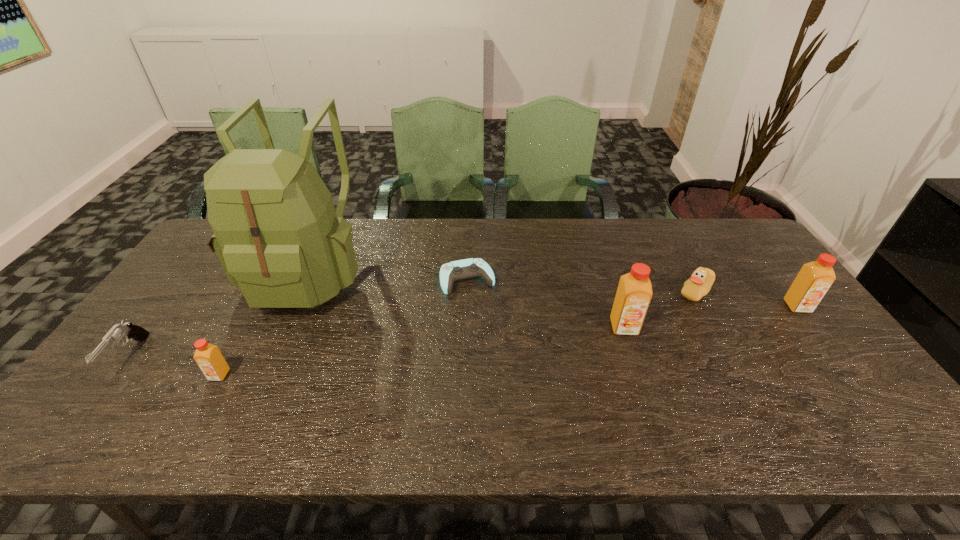
This screenshot has width=960, height=540. Identify the location of free spot between the fourth object from left to right and the duck. (582, 286).

At what (x,y) coordinates should I click in order to perform the action: click on free area in between the shortest orange juice and the fourth object from right to left. Please return your answer as a coordinate pair (x, y). Image resolution: width=960 pixels, height=540 pixels. Looking at the image, I should click on (344, 327).

Locate an element on the screen. The image size is (960, 540). free space between the second nearest orange juice and the tallest object is located at coordinates (467, 299).

At what (x,y) coordinates should I click in order to perform the action: click on free space between the second orange juice from left to right and the second shortest orange juice. Please return your answer as a coordinate pair (x, y). The height and width of the screenshot is (540, 960). Looking at the image, I should click on (710, 316).

Where is `unoccupied area between the leftmost object and the backpack`? The width and height of the screenshot is (960, 540). unoccupied area between the leftmost object and the backpack is located at coordinates (219, 314).

Where is `free space between the second shortest orange juice and the second object from right to left`? The height and width of the screenshot is (540, 960). free space between the second shortest orange juice and the second object from right to left is located at coordinates (746, 299).

The image size is (960, 540). Find the location of `unoccupied area between the second object from right to left and the farthest orange juice`. unoccupied area between the second object from right to left and the farthest orange juice is located at coordinates click(746, 299).

Where is `vacant region between the shortest object and the shortest orange juice`? This screenshot has width=960, height=540. vacant region between the shortest object and the shortest orange juice is located at coordinates (344, 327).

The height and width of the screenshot is (540, 960). In order to click on free space between the backpack and the shortest object in this screenshot , I will do `click(388, 275)`.

Where is `object identified as the closest to the leftmost orange juice`? Image resolution: width=960 pixels, height=540 pixels. object identified as the closest to the leftmost orange juice is located at coordinates [x=277, y=236].